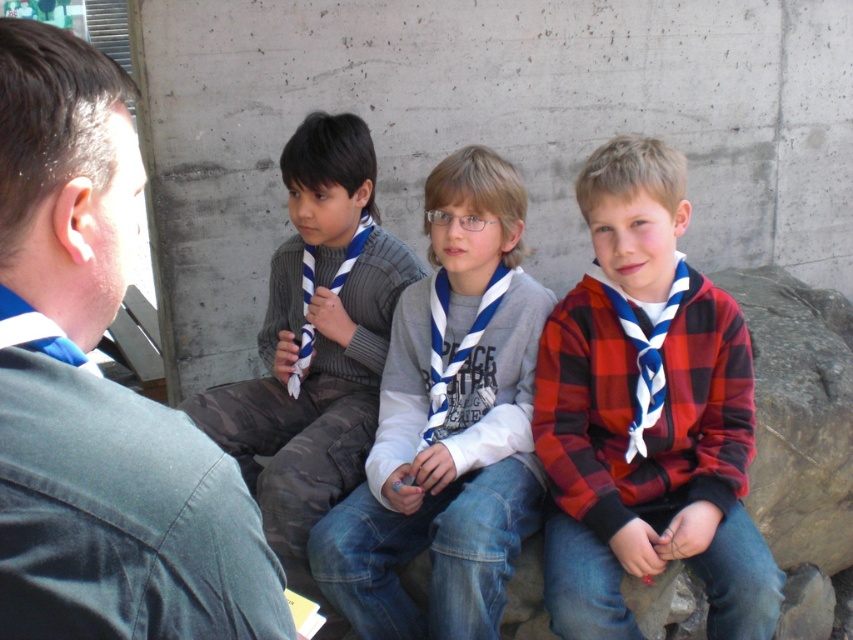
Does dark gray shirt at left lie in front of white striped tie at center?

Yes, it is in front of white striped tie at center.

Does point (51, 88) come closer to viewer compared to point (334, 291)?

Yes.

Locate an element on the screen. dark gray shirt at left is located at coordinates (99, 390).

Can you confirm if red plaid shirt at center is taller than white striped tie at center?

Correct, red plaid shirt at center is much taller as white striped tie at center.

Between point (630, 140) and point (354, 252), which one is positioned in front?

Point (630, 140) is more forward.

Between point (614, 284) and point (305, 243), which one is positioned in front?

Point (614, 284)

Find the location of a particular element. red plaid shirt at center is located at coordinates (646, 416).

Between red plaid shirt at center and white cotton scarf at center, which one has more height?

With more height is red plaid shirt at center.

Can you confirm if red plaid shirt at center is wider than white cotton scarf at center?

No, red plaid shirt at center is not wider than white cotton scarf at center.

Who is more distant from viewer, (567, 372) or (439, 556)?

The point (567, 372) is behind.

Where is `red plaid shirt at center`? The height and width of the screenshot is (640, 853). red plaid shirt at center is located at coordinates (646, 416).